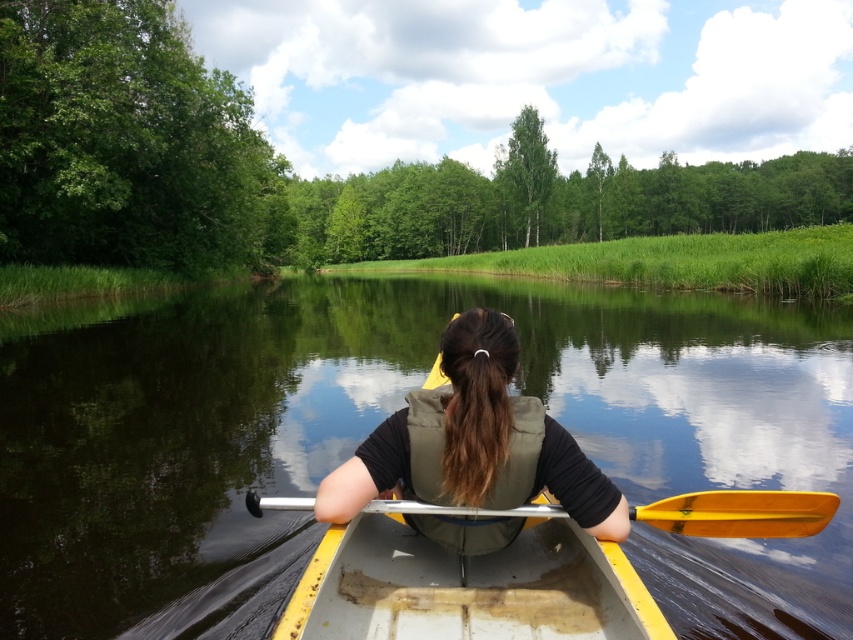
Question: Is yellow plastic canoe at center in front of matte green life vest at center?

Choices:
 (A) yes
 (B) no

Answer: (A)

Question: Is matte green life vest at center wider than yellow plastic paddle at center?

Choices:
 (A) yes
 (B) no

Answer: (A)

Question: Among these objects, which one is nearest to the camera?

Choices:
 (A) smooth water at center
 (B) yellow plastic canoe at center
 (C) matte green life vest at center
 (D) yellow plastic paddle at center

Answer: (B)

Question: Which object is positioned farthest from the matte green life vest at center?

Choices:
 (A) yellow plastic paddle at center
 (B) smooth water at center

Answer: (B)

Question: Can you confirm if smooth water at center is positioned above yellow plastic paddle at center?

Choices:
 (A) no
 (B) yes

Answer: (B)

Question: Which object is closer to the camera taking this photo?

Choices:
 (A) yellow plastic canoe at center
 (B) smooth water at center
 (C) matte green life vest at center

Answer: (A)